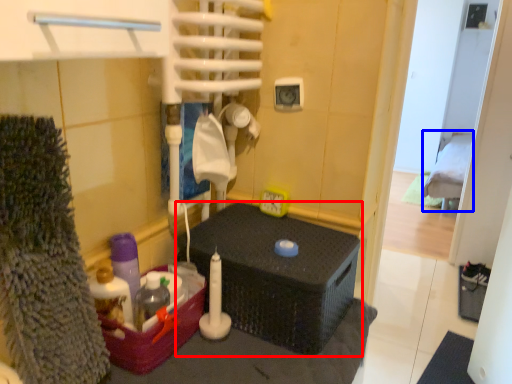
Question: Which object appears closest to the camera in this image, furniture (highlighted by a red box) or bed (highlighted by a blue box)?

Choices:
 (A) furniture
 (B) bed

Answer: (A)